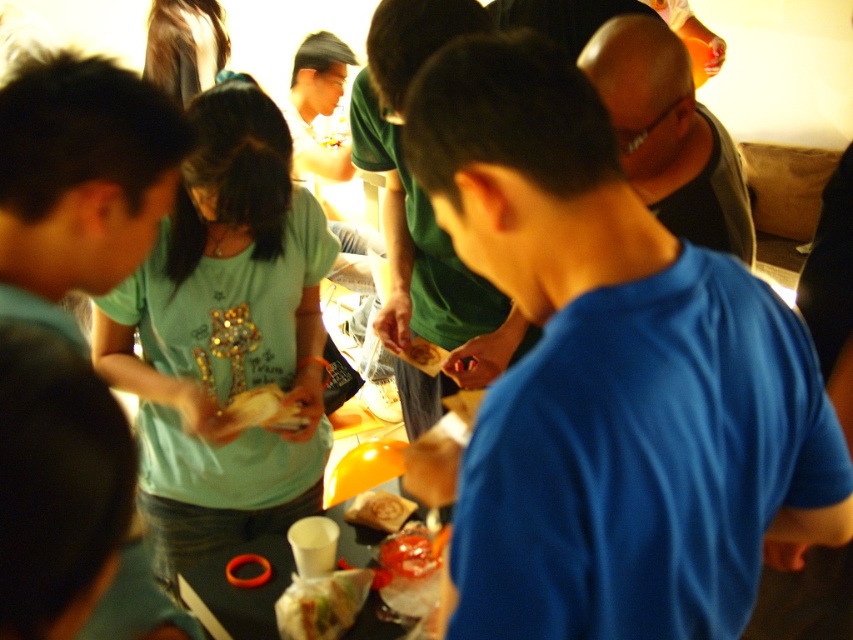
Question: Where is blue smooth shirt at center located in relation to matte brown pastry at center in the image?

Choices:
 (A) right
 (B) left

Answer: (A)

Question: Among these objects, which one is farthest from the camera?

Choices:
 (A) white paper bag at center
 (B) smooth plastic snack at center
 (C) blue smooth shirt at center
 (D) black matte tank top at upper right

Answer: (B)

Question: Is blue smooth shirt at center to the right of black matte tank top at upper right from the viewer's perspective?

Choices:
 (A) yes
 (B) no

Answer: (B)

Question: Which point is closer to the camera?

Choices:
 (A) smooth plastic snack at center
 (B) black matte tank top at upper right
 (C) matte brown pastry at center

Answer: (B)

Question: Does black matte tank top at upper right appear on the left side of smooth plastic snack at center?

Choices:
 (A) yes
 (B) no

Answer: (B)

Question: Which of the following is the farthest from the observer?

Choices:
 (A) (741, 611)
 (B) (619, 150)

Answer: (B)